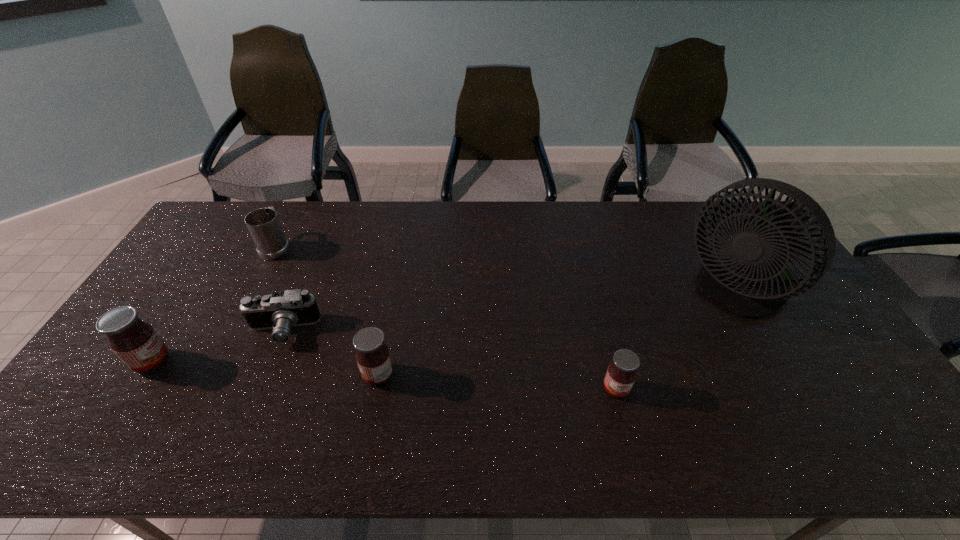
I want to click on jam that is the second closest to the third object from right to left, so click(621, 373).

The height and width of the screenshot is (540, 960). Identify the location of vacant space that satisfies the following two spatial constraints: 1. in front of the rightmost object to direct airflow; 2. at the lens of the camera. (759, 330).

At what (x,y) coordinates should I click in order to perform the action: click on vacant region that satisfies the following two spatial constraints: 1. in front of the rightmost object to direct airflow; 2. at the lens of the shortest object. Please return your answer as a coordinate pair (x, y). This screenshot has height=540, width=960. Looking at the image, I should click on (759, 330).

The height and width of the screenshot is (540, 960). I want to click on free spot that satisfies the following two spatial constraints: 1. in front of the rightmost object to direct airflow; 2. at the lens of the camera, so click(759, 330).